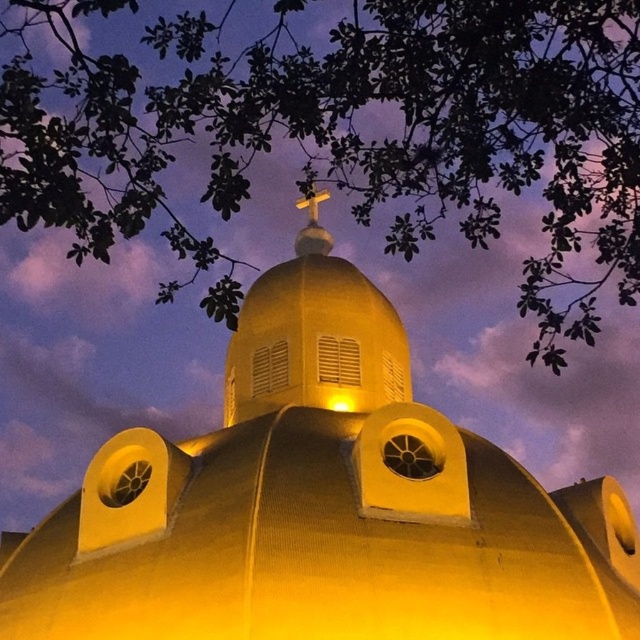
Can you confirm if green leafy tree at upper center is positioned below gold metallic cross at center?

No.

Consider the image. Is green leafy tree at upper center wider than gold metallic cross at center?

Indeed, green leafy tree at upper center has a greater width compared to gold metallic cross at center.

Image resolution: width=640 pixels, height=640 pixels. I want to click on green leafy tree at upper center, so click(348, 131).

Which is above, golden matte dome at center or gold metallic cross at center?

gold metallic cross at center is above.

Can you confirm if golden matte dome at center is thinner than gold metallic cross at center?

No, golden matte dome at center is not thinner than gold metallic cross at center.

Does point (310, 589) come farther from viewer compared to point (320, 195)?

That is False.

The width and height of the screenshot is (640, 640). What are the coordinates of `golden matte dome at center` in the screenshot? It's located at (321, 504).

Who is positioned more to the left, golden matte dome at center or green leafy tree at upper center?

Positioned to the left is golden matte dome at center.

Where is `golden matte dome at center`? The image size is (640, 640). golden matte dome at center is located at coordinates (321, 504).

Who is more distant from viewer, (403, 454) or (540, 115)?

The point (403, 454) is more distant.

At what (x,y) coordinates should I click in order to perform the action: click on golden matte dome at center. Please return your answer as a coordinate pair (x, y). Looking at the image, I should click on (321, 504).